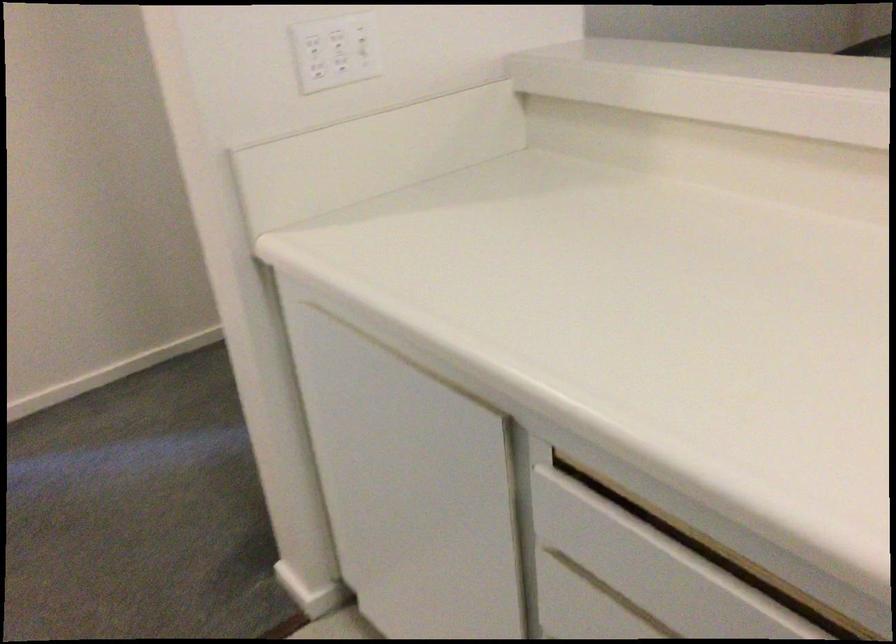
Image resolution: width=896 pixels, height=644 pixels. Describe the element at coordinates (640, 574) in the screenshot. I see `the drawer handle recess` at that location.